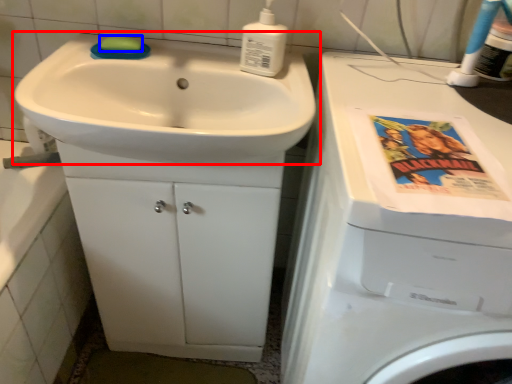
Question: Which of the following is the closest to the observer, sink (highlighted by a red box) or soap (highlighted by a blue box)?

Choices:
 (A) sink
 (B) soap

Answer: (A)